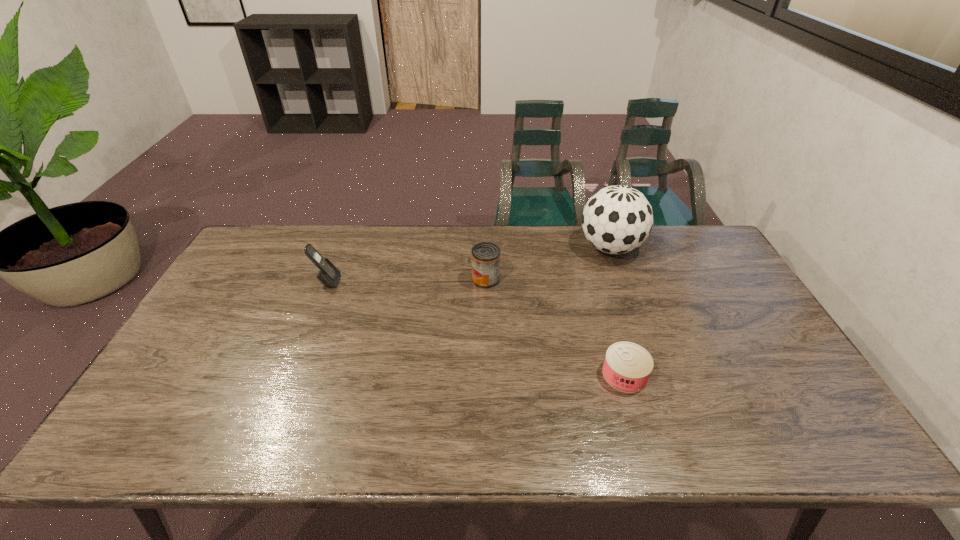
Where is `vacant space that satisfies the following two spatial constraints: 1. on the front-facing side of the leftmost object; 2. on the back side of the shortest object`? The image size is (960, 540). vacant space that satisfies the following two spatial constraints: 1. on the front-facing side of the leftmost object; 2. on the back side of the shortest object is located at coordinates (291, 375).

At what (x,y) coordinates should I click in order to perform the action: click on free location that satisfies the following two spatial constraints: 1. on the front-facing side of the nearer can; 2. on the right side of the cellular telephone. Please return your answer as a coordinate pair (x, y). The width and height of the screenshot is (960, 540). Looking at the image, I should click on (291, 375).